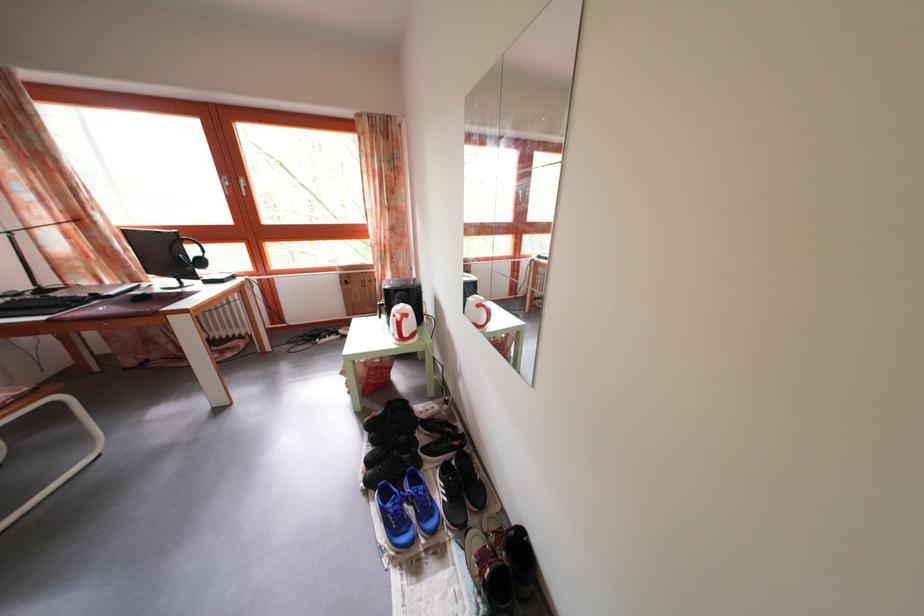
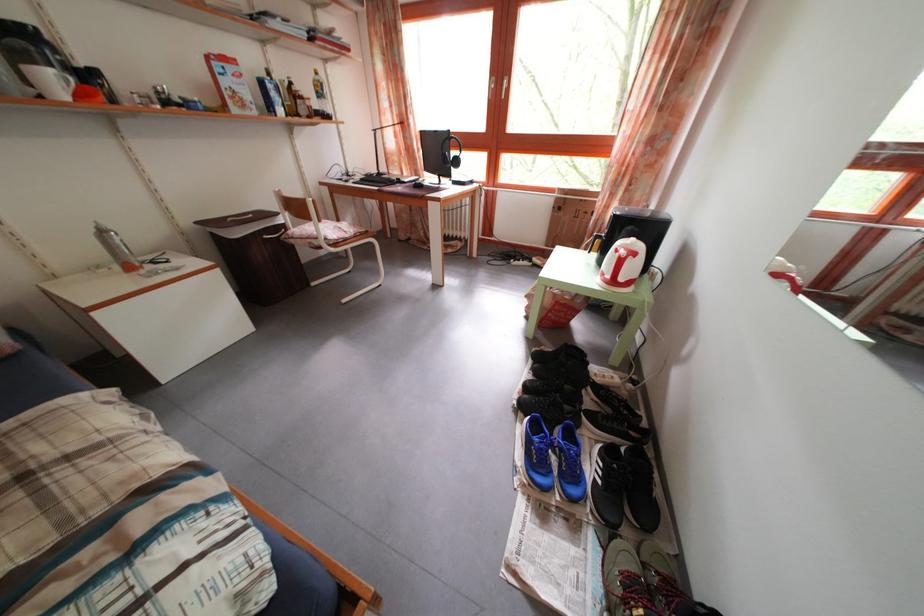
The point at [460,469] is marked in the first image. Where is the corresponding point in the second image?

(629, 458)